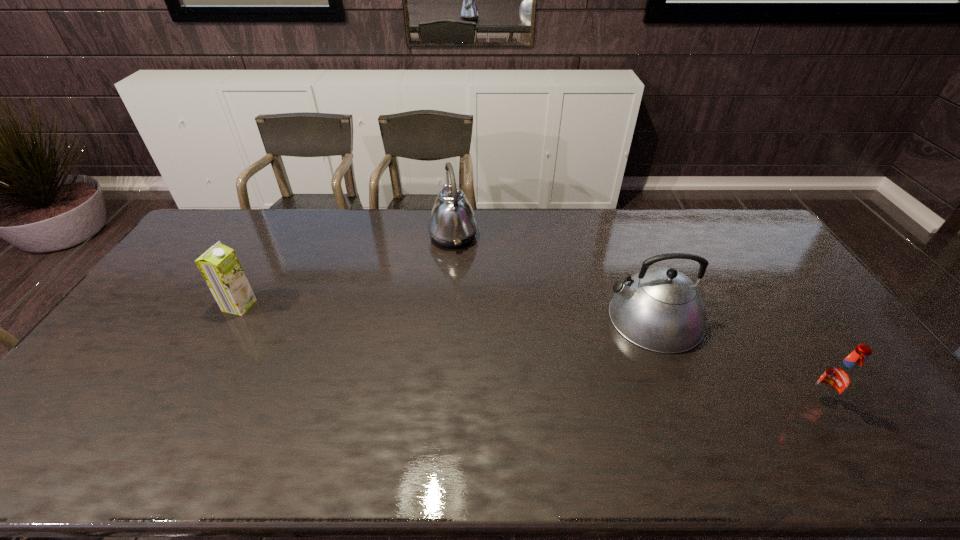
Where is `vacant space that is in between the soya milk and the nearer kettle`? vacant space that is in between the soya milk and the nearer kettle is located at coordinates (446, 312).

Where is `free spot between the third object from right to left and the soya milk`? This screenshot has height=540, width=960. free spot between the third object from right to left and the soya milk is located at coordinates (347, 271).

Locate an element on the screen. Image resolution: width=960 pixels, height=540 pixels. unoccupied position between the left kettle and the leftmost object is located at coordinates (347, 271).

Identify the location of unoccupied position between the second object from right to left and the leftmost object. Image resolution: width=960 pixels, height=540 pixels. (446, 312).

Identify the location of free space between the nearer kettle and the root beer. (735, 360).

What are the coordinates of `the second closest object to the soya milk` in the screenshot? It's located at (659, 309).

Point out which object is positioned as the nearest to the rightmost object. Please provide its 2D coordinates. Your answer should be formatted as a tuple, i.e. [(x, y)], where the tuple contains the x and y coordinates of a point satisfying the conditions above.

[(659, 309)]

Where is `free location that satisfies the following two spatial constraints: 1. from the spout of the shorter kettle; 2. on the left side of the rightmost object`? free location that satisfies the following two spatial constraints: 1. from the spout of the shorter kettle; 2. on the left side of the rightmost object is located at coordinates (686, 402).

Image resolution: width=960 pixels, height=540 pixels. What are the coordinates of `free space that satisfies the following two spatial constraints: 1. from the spout of the third object from left to right; 2. on the left side of the rightmost object` in the screenshot? It's located at (686, 402).

This screenshot has height=540, width=960. I want to click on vacant space that satisfies the following two spatial constraints: 1. on the back side of the root beer; 2. from the spout of the shorter kettle, so point(764,318).